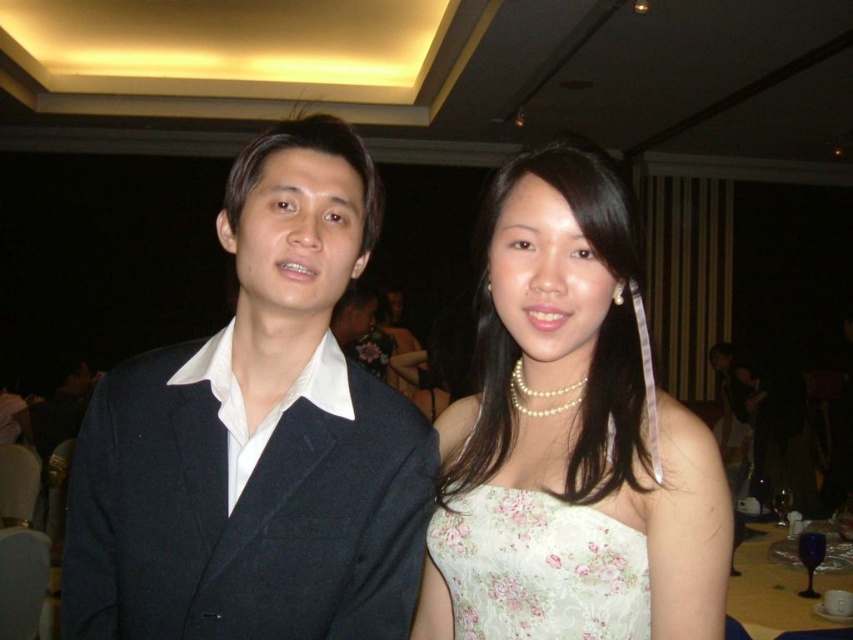
Who is more forward, (155,486) or (480,324)?

Positioned in front is point (155,486).

Which is behind, point (287, 566) or point (595, 397)?

The point (595, 397) is behind.

Between point (350, 529) and point (466, 612), which one is positioned behind?

Positioned behind is point (466, 612).

Find the location of a particular element. This screenshot has height=640, width=853. matte black suit at center is located at coordinates (257, 438).

Is matte black suit at center below translucent glassware at lower right?

Actually, matte black suit at center is above translucent glassware at lower right.

Who is more forward, (341,634) or (793,602)?

Positioned in front is point (341,634).

Where is `matte black suit at center`? This screenshot has height=640, width=853. matte black suit at center is located at coordinates (257, 438).

Which is more to the left, white floral dress at center or floral satin dress at center?

From the viewer's perspective, floral satin dress at center appears more on the left side.

Can you confirm if white floral dress at center is positioned above floral satin dress at center?

Correct, white floral dress at center is located above floral satin dress at center.

Locate an element on the screen. This screenshot has width=853, height=640. white floral dress at center is located at coordinates (575, 403).